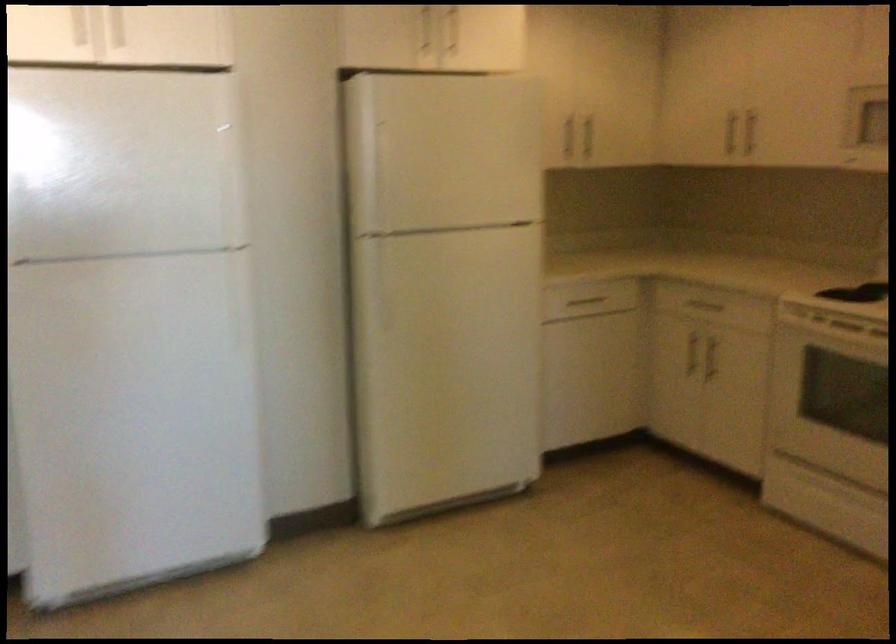
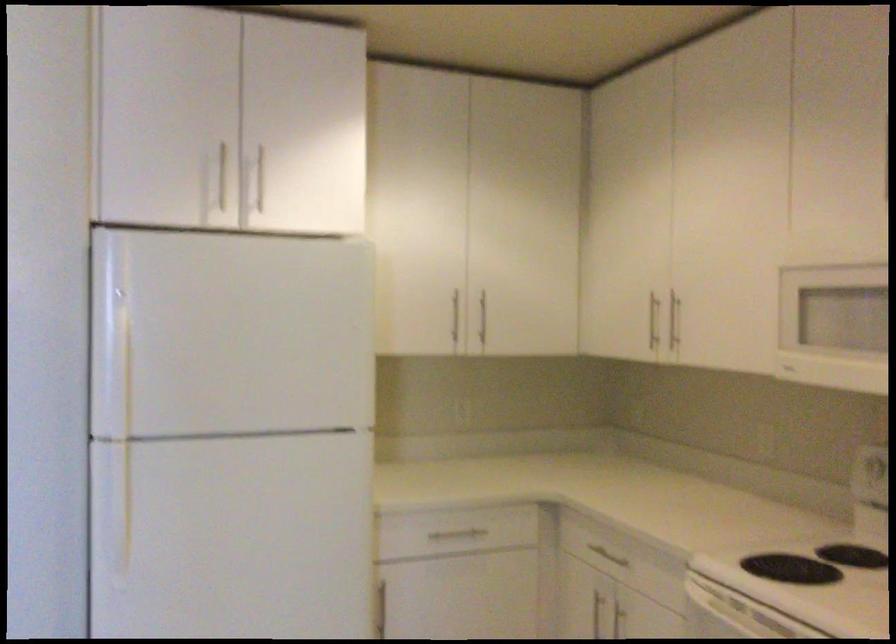
The point at [586,136] is marked in the first image. Where is the corresponding point in the second image?

(483, 317)